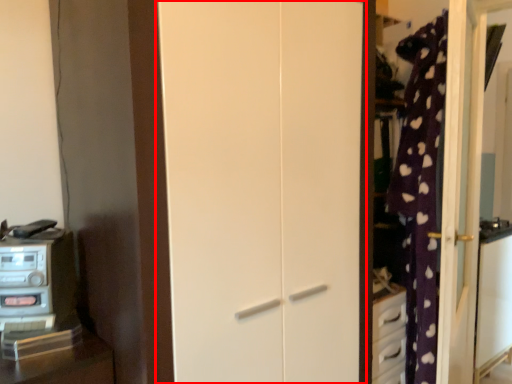
Question: From the image's perspective, what is the correct spatial relationship of door (annotated by the red box) in relation to appliance?

Choices:
 (A) above
 (B) below

Answer: (A)